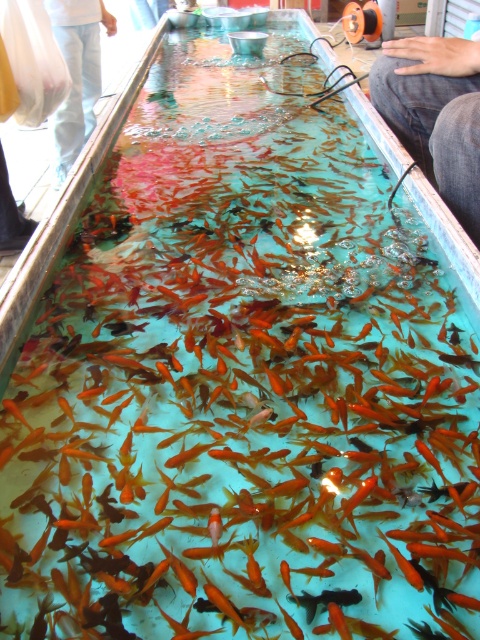
The image size is (480, 640). What do you see at coordinates (435, 115) in the screenshot? I see `jeans at center` at bounding box center [435, 115].

Can you confirm if jeans at center is wider than white cotton pants at upper left?

No.

The image size is (480, 640). Find the location of `jeans at center`. jeans at center is located at coordinates (435, 115).

The height and width of the screenshot is (640, 480). I want to click on jeans at center, so click(x=435, y=115).